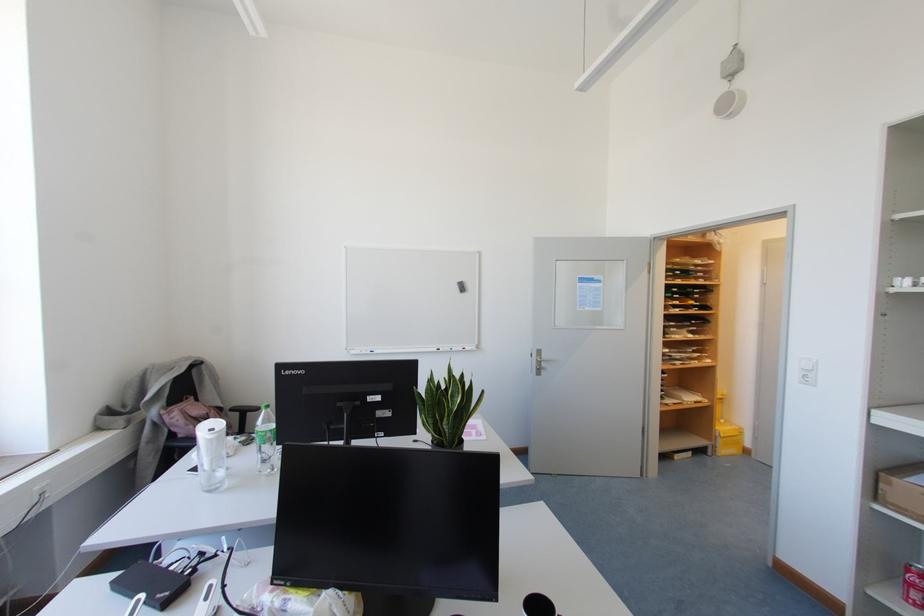
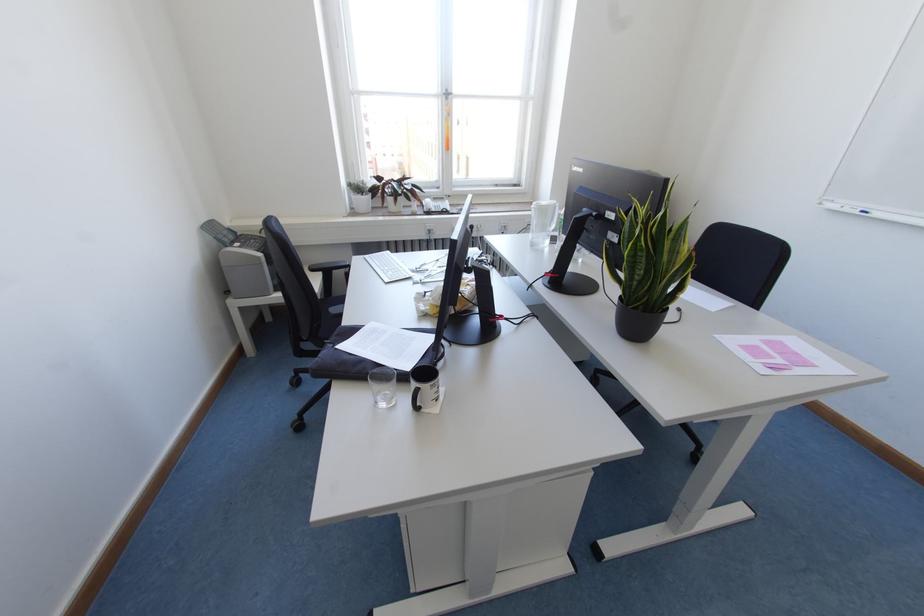
The point at (x=371, y=351) is marked in the first image. Where is the corresponding point in the second image?

(864, 213)